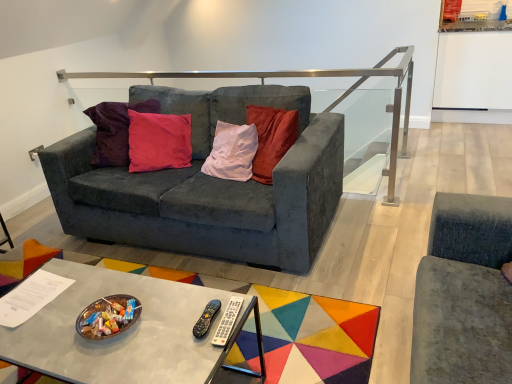
Question: Is black plastic remote at center, which is the 1th remote from left to right, wider or thinner than metallic gray coffee table at center?

Choices:
 (A) thin
 (B) wide

Answer: (A)

Question: From the image's perspective, is black plastic remote at center, which is the 1th remote from left to right, positioned above or below metallic gray coffee table at center?

Choices:
 (A) below
 (B) above

Answer: (B)

Question: Based on their relative distances, which object is nearer to the metallic gray coffee table at center?

Choices:
 (A) black plastic remote at center, positioned as the 2th remote in right-to-left order
 (B) silver plastic remote at center, arranged as the 1th remote when viewed from the right
 (C) satin silver rail at upper center
 (D) velvet dark gray couch at center

Answer: (A)

Question: Which object is positioned closest to the satin silver rail at upper center?

Choices:
 (A) metallic gray coffee table at center
 (B) black plastic remote at center, positioned as the 2th remote in right-to-left order
 (C) silver plastic remote at center, the 2th remote when ordered from left to right
 (D) velvet dark gray couch at center

Answer: (D)